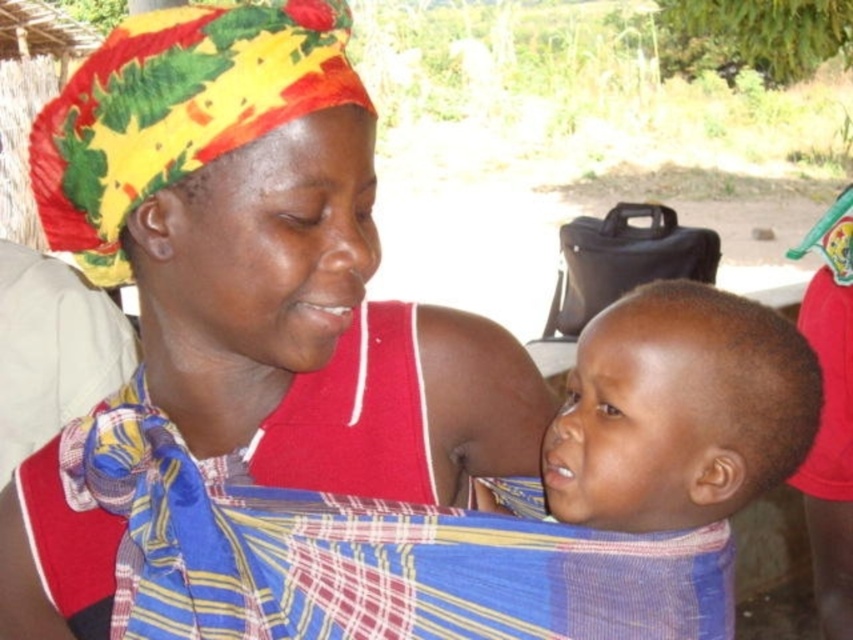
In the scene shown: Who is positioned more to the left, matte red tank top at center or smooth fabric baby at center?

From the viewer's perspective, matte red tank top at center appears more on the left side.

Is matte red tank top at center in front of smooth fabric baby at center?

That is True.

Who is more forward, [236,227] or [633,470]?

Point [236,227]

Find the location of `matte red tank top at center`. matte red tank top at center is located at coordinates (271, 259).